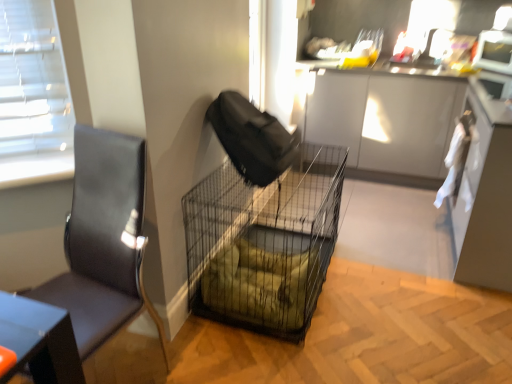
Question: Is black leather chair at left wider than metal mesh crate at center?

Choices:
 (A) yes
 (B) no

Answer: (B)

Question: From the image's perspective, does black leather chair at left appear lower than metal mesh crate at center?

Choices:
 (A) yes
 (B) no

Answer: (A)

Question: Is black leather chair at left shorter than metal mesh crate at center?

Choices:
 (A) yes
 (B) no

Answer: (B)

Question: Does black leather chair at left have a greater height compared to metal mesh crate at center?

Choices:
 (A) no
 (B) yes

Answer: (B)

Question: Is black leather chair at left next to metal mesh crate at center?

Choices:
 (A) no
 (B) yes

Answer: (A)

Question: Considering the positions of metal mesh crate at center and white glossy microwave at upper right in the image, is metal mesh crate at center bigger or smaller than white glossy microwave at upper right?

Choices:
 (A) big
 (B) small

Answer: (A)

Question: Looking at their shapes, would you say metal mesh crate at center is wider or thinner than white glossy microwave at upper right?

Choices:
 (A) thin
 (B) wide

Answer: (B)

Question: Relative to white glossy microwave at upper right, is metal mesh crate at center in front or behind?

Choices:
 (A) front
 (B) behind

Answer: (A)

Question: Choose the correct answer: Is metal mesh crate at center inside white glossy microwave at upper right or outside it?

Choices:
 (A) outside
 (B) inside

Answer: (A)

Question: Is white cloth at right inside the boundaries of white glossy microwave at upper right, or outside?

Choices:
 (A) inside
 (B) outside

Answer: (B)

Question: From their relative heights in the image, would you say white cloth at right is taller or shorter than white glossy microwave at upper right?

Choices:
 (A) tall
 (B) short

Answer: (A)

Question: Considering the relative positions of white cloth at right and white glossy microwave at upper right in the image provided, is white cloth at right to the left or to the right of white glossy microwave at upper right?

Choices:
 (A) left
 (B) right

Answer: (A)

Question: From the image's perspective, relative to white glossy microwave at upper right, is white cloth at right above or below?

Choices:
 (A) below
 (B) above

Answer: (A)

Question: Looking at their shapes, would you say black wire mesh cage at center is wider or thinner than metal mesh crate at center?

Choices:
 (A) wide
 (B) thin

Answer: (B)

Question: Considering the positions of point (202, 309) and point (509, 157), is point (202, 309) closer or farther from the camera than point (509, 157)?

Choices:
 (A) farther
 (B) closer

Answer: (A)